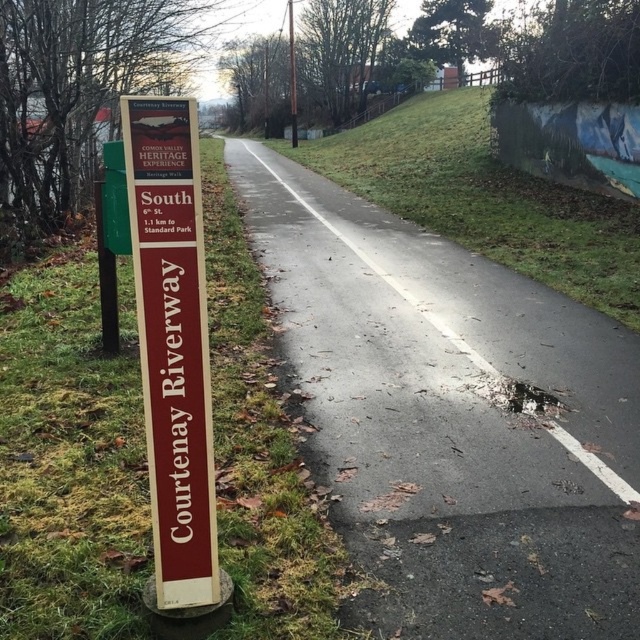
You are a hiker trying to read the signs along the path. Which sign, the maroon wood sign at left or the green plastic signpost at left, would you see first as you approach the path?

The maroon wood sign at left is in front of the green plastic signpost at left, so you would see the maroon wood sign at left first as you approach the path.

You are a hiker trying to read the signs along the path. Which sign is positioned lower on the left side of the path, the maroon wood sign at left or the green plastic signpost at left?

The maroon wood sign at left is located below the green plastic signpost at left, so it is positioned lower on the left side of the path.